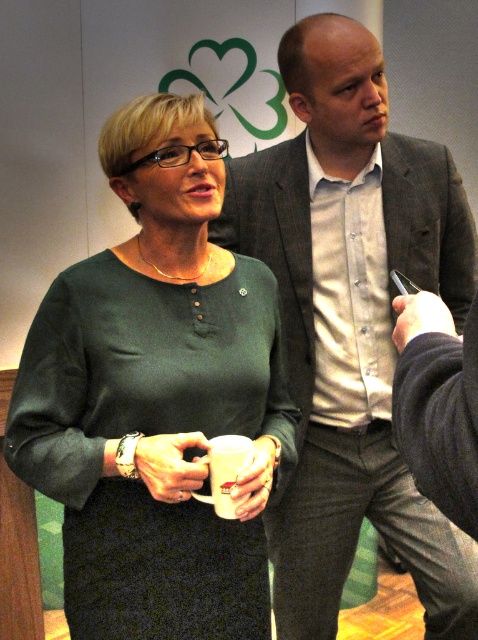
Between matte green dress at center and white matte mug at center, which one appears on the left side from the viewer's perspective?

matte green dress at center

Who is more distant from viewer, (206, 124) or (228, 476)?

Positioned behind is point (206, 124).

Identify the location of matte green dress at center. This screenshot has height=640, width=478. (155, 397).

Can you confirm if matte green dress at center is shorter than matte gray suit at center?

Yes, matte green dress at center is shorter than matte gray suit at center.

Who is taller, matte green dress at center or matte gray suit at center?

matte gray suit at center is taller.

Does point (121, 435) lie in front of point (303, 481)?

Yes.

At what (x,y) coordinates should I click in order to perform the action: click on matte green dress at center. Please return your answer as a coordinate pair (x, y). Looking at the image, I should click on (155, 397).

Which is behind, point (425, 147) or point (210, 449)?

Point (425, 147)

Does matte gray suit at center have a lesser width compared to white matte mug at center?

In fact, matte gray suit at center might be wider than white matte mug at center.

Between point (399, 552) and point (224, 444), which one is positioned in front?

Point (224, 444) is more forward.

The height and width of the screenshot is (640, 478). What are the coordinates of `matte gray suit at center` in the screenshot? It's located at (350, 323).